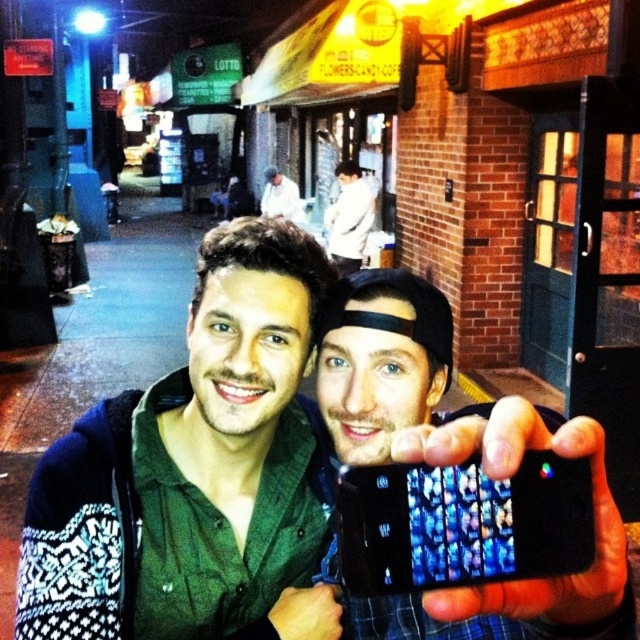
Question: Which object appears closest to the camera in this image?

Choices:
 (A) green matte shirt at center
 (B) white cotton shirt at center
 (C) black matte phone at center

Answer: (C)

Question: Considering the relative positions of green matte shirt at center and black glossy smartphone at center in the image provided, where is green matte shirt at center located with respect to black glossy smartphone at center?

Choices:
 (A) above
 (B) below

Answer: (B)

Question: Which point is closer to the camera?

Choices:
 (A) (589, 433)
 (B) (282, 429)

Answer: (A)

Question: Which of the following is the closest to the observer?

Choices:
 (A) (300, 212)
 (B) (346, 556)
 (C) (452, 632)
 (D) (358, 241)

Answer: (B)

Question: Does black glossy phone at center appear over white matte shirt at center?

Choices:
 (A) yes
 (B) no

Answer: (B)

Question: Is black glossy phone at center to the left of black matte phone at center from the viewer's perspective?

Choices:
 (A) no
 (B) yes

Answer: (A)